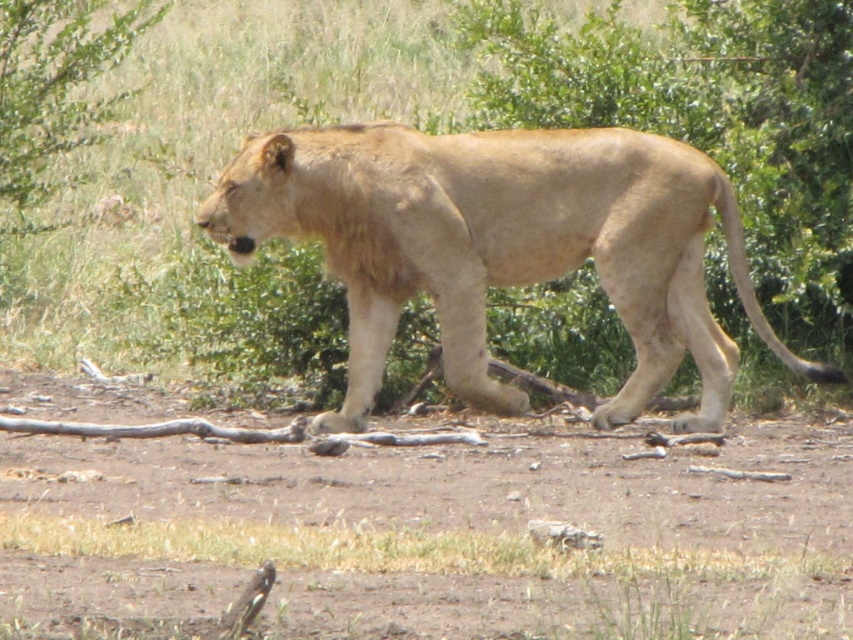
You are a photographer trying to capture the lioness in the image. You notice two points marked in the scene. The first point is at coordinate point (6,568), and the second is at point (358,188). Which point is closer to your camera lens?

Point (6,568) is closer to the camera than point (358,188).

You are a photographer aiming to capture the lioness walking across the brown dirt field at center and the green leafy bush at upper left. Which object is closer to the ground?

The brown dirt field at center is closer to the ground since it has a lesser height compared to the green leafy bush at upper left.

You are a wildlife photographer trying to capture the lioness in the image. You want to place your focus point at the center of the brown dirt field where the lioness is walking. Is the point labeled as point (438, 532) on the brown dirt field at center?

Yes, the point (438, 532) is on the brown dirt field at center, so placing the focus point there will ensure the lioness is in focus as she walks across the dirt field.